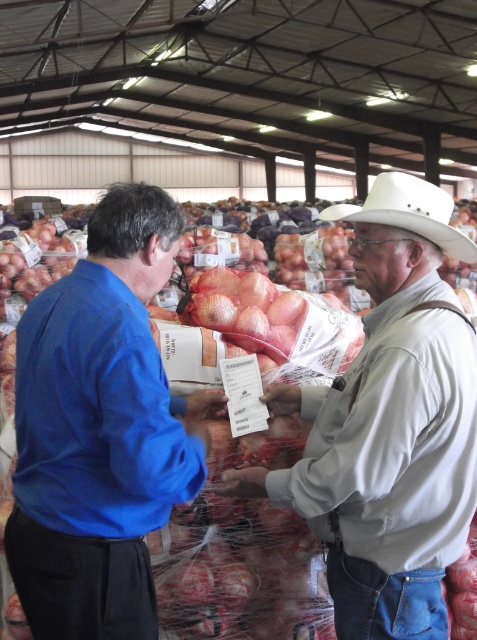
Does blue fabric shirt at left appear under light gray cotton shirt at center?

Indeed, blue fabric shirt at left is positioned under light gray cotton shirt at center.

Is blue fabric shirt at left closer to camera compared to light gray cotton shirt at center?

Yes, blue fabric shirt at left is closer to the viewer.

From the picture: Who is more forward, (68, 484) or (406, 278)?

Point (68, 484) is in front.

Where is `blue fabric shirt at left`? The height and width of the screenshot is (640, 477). blue fabric shirt at left is located at coordinates (101, 429).

Can you confirm if light gray cotton shirt at center is smaller than white matte cowboy hat at center?

Actually, light gray cotton shirt at center might be larger than white matte cowboy hat at center.

Which is below, light gray cotton shirt at center or white matte cowboy hat at center?

light gray cotton shirt at center

Does point (281, 499) come farther from viewer compared to point (354, 214)?

That is True.

The image size is (477, 640). Find the location of `light gray cotton shirt at center`. light gray cotton shirt at center is located at coordinates (389, 424).

Which is below, blue fabric shirt at left or white matte cowboy hat at center?

Positioned lower is blue fabric shirt at left.

Between blue fabric shirt at left and white matte cowboy hat at center, which one appears on the right side from the viewer's perspective?

white matte cowboy hat at center is more to the right.

Where is `blue fabric shirt at left`? blue fabric shirt at left is located at coordinates (101, 429).